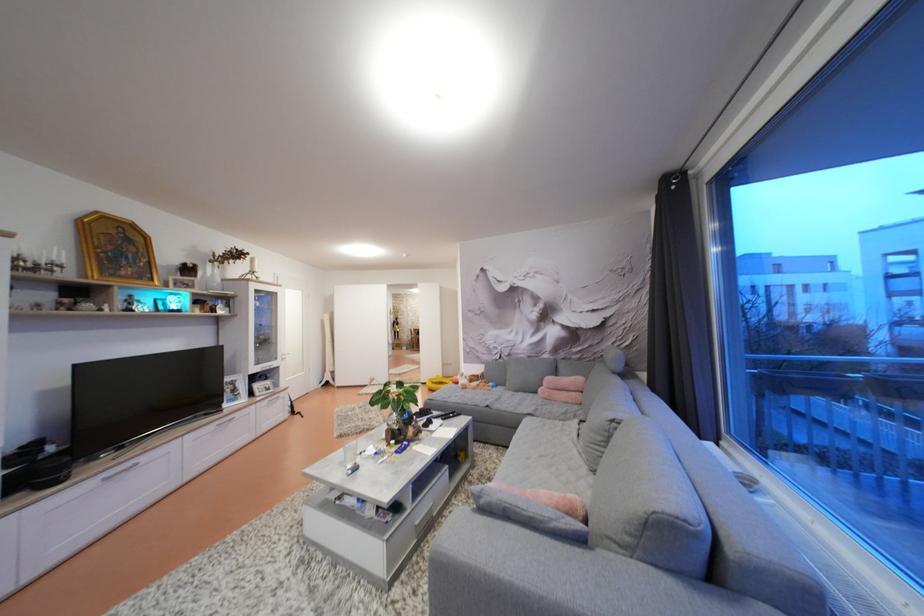
I want to click on grey sofa sitting surface, so click(x=561, y=458).